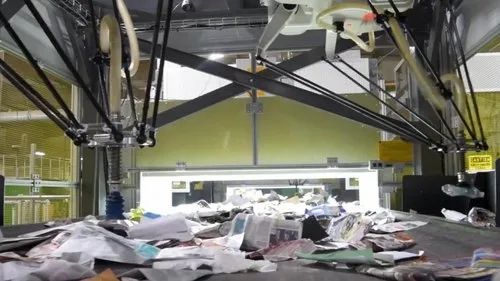
Identify the location of wall. (328, 138), (213, 129).